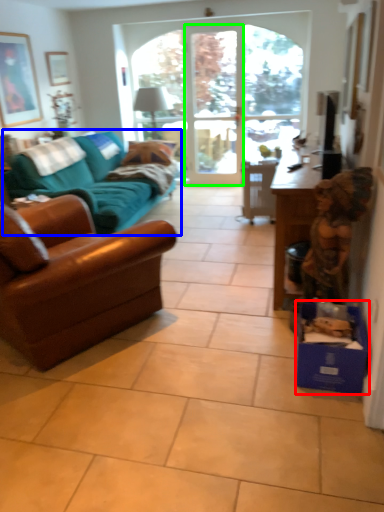
Question: Estimate the real-world distances between objects in this image. Which object is farther from cardboard box (highlighted by a red box), studio couch (highlighted by a blue box) or screen door (highlighted by a green box)?

Choices:
 (A) studio couch
 (B) screen door

Answer: (B)